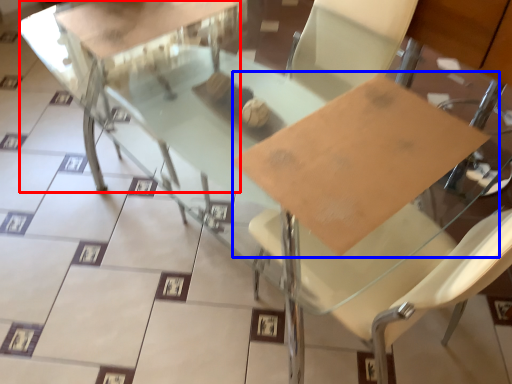
Question: Which object appears closest to the camera in this image, round table (highlighted by a red box) or cardboard (highlighted by a blue box)?

Choices:
 (A) round table
 (B) cardboard

Answer: (B)